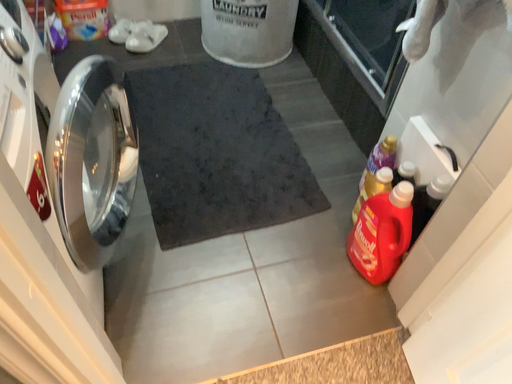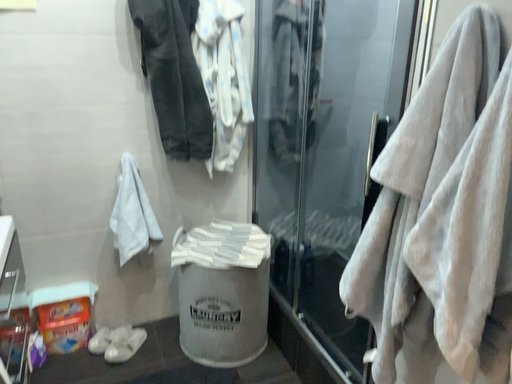
Question: How did the camera likely rotate when shooting the video?

Choices:
 (A) rotated upward
 (B) rotated downward

Answer: (A)